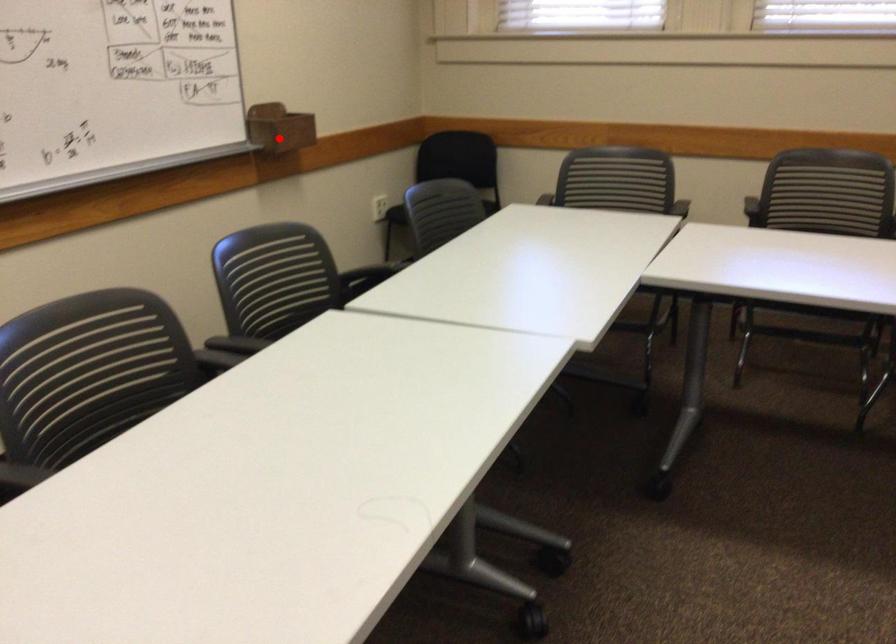
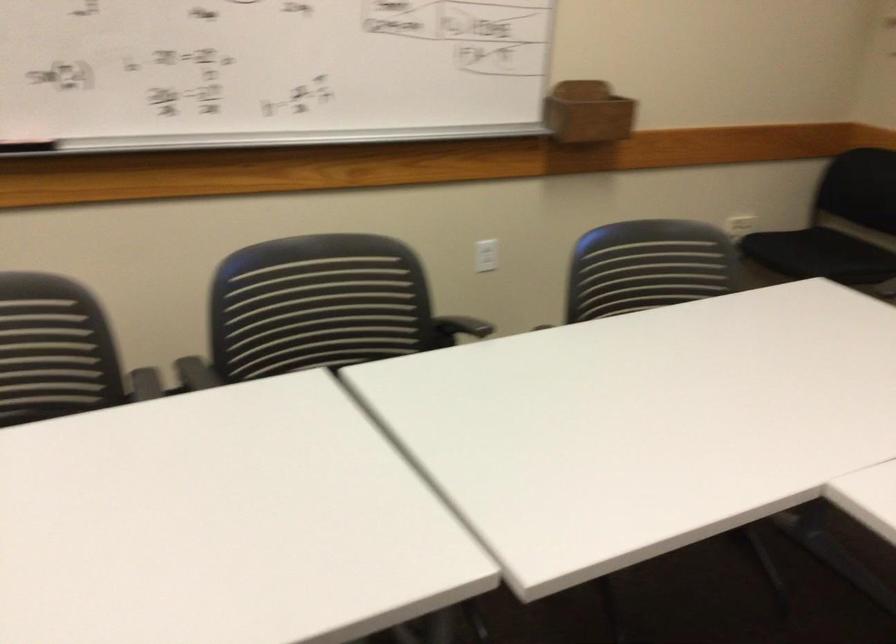
Question: I am providing you with two images of the same scene from different viewpoints. Given a red point in image1, look at the same physical point in image2. Is it:

Choices:
 (A) Closer to the viewpoint
 (B) Farther from the viewpoint

Answer: (A)